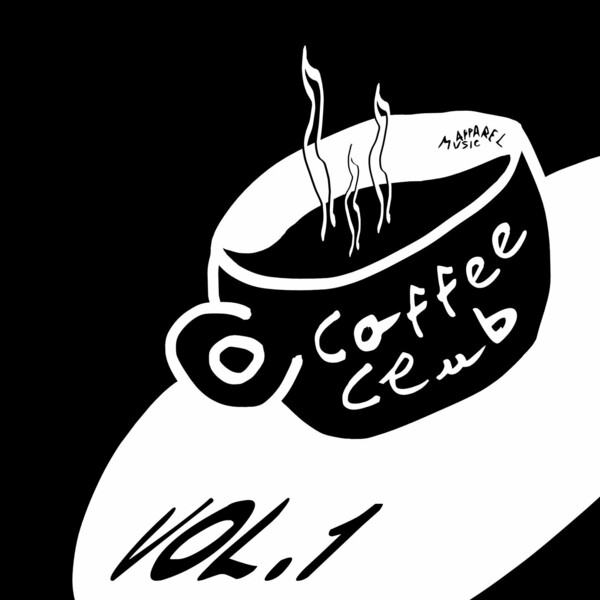
Locate an element on the screen. This screenshot has width=600, height=600. steam coming from coffee is located at coordinates (313, 87), (355, 175), (383, 107).